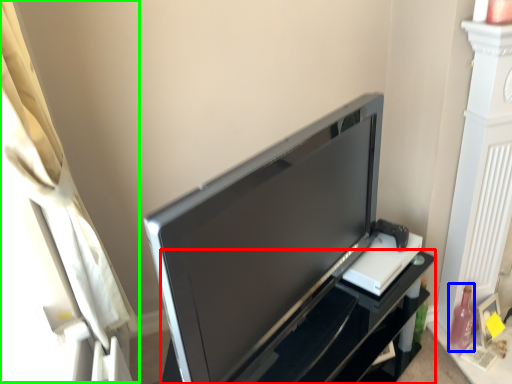
Question: Which is farther away from furniture (highlighted by a red box)? bottle (highlighted by a blue box) or curtain (highlighted by a green box)?

Choices:
 (A) bottle
 (B) curtain

Answer: (B)